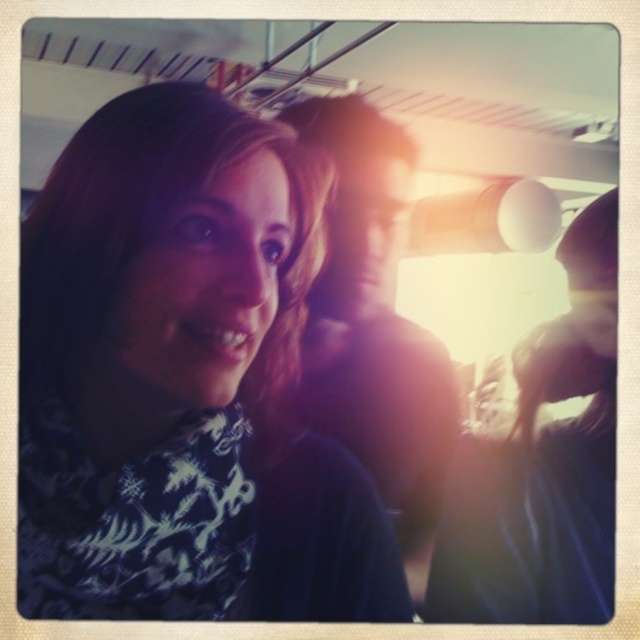
Identify the location of matte black scarf at left. This screenshot has width=640, height=640. (182, 380).

Can you confirm if matte black scarf at left is positioned above smooth dark hair at center?

No.

The height and width of the screenshot is (640, 640). Describe the element at coordinates (182, 380) in the screenshot. I see `matte black scarf at left` at that location.

Where is `matte black scarf at left`? The image size is (640, 640). matte black scarf at left is located at coordinates (182, 380).